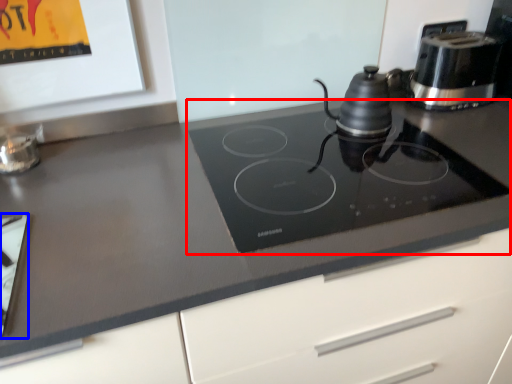
Question: Which object is closer to the camera taking this photo, gas stove (highlighted by a red box) or appliance (highlighted by a blue box)?

Choices:
 (A) gas stove
 (B) appliance

Answer: (B)